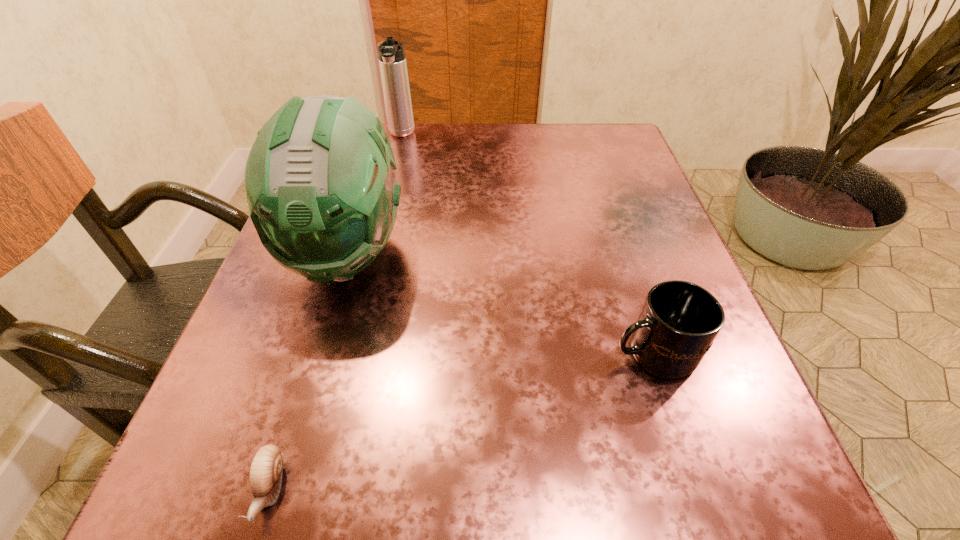
Where is `vacant area that lies between the farthest object and the shortest object`? The height and width of the screenshot is (540, 960). vacant area that lies between the farthest object and the shortest object is located at coordinates (336, 312).

Locate an element on the screen. The height and width of the screenshot is (540, 960). free area in between the nearest object and the second tallest object is located at coordinates (336, 312).

Identify the location of empty space between the rightmost object and the nearest object. The width and height of the screenshot is (960, 540). (462, 421).

Identify the location of free spot between the nearest object and the tallest object. The width and height of the screenshot is (960, 540). (309, 371).

Image resolution: width=960 pixels, height=540 pixels. Find the location of `empty location between the escargot and the third nearest object`. empty location between the escargot and the third nearest object is located at coordinates (309, 371).

Identify the location of empty space between the football helmet and the nearest object. (309, 371).

Identify which object is the second closest to the thermos bottle. Please provide its 2D coordinates. Your answer should be formatted as a tuple, i.e. [(x, y)], where the tuple contains the x and y coordinates of a point satisfying the conditions above.

[(679, 321)]

The height and width of the screenshot is (540, 960). In order to click on object that is the closest to the third nearest object in this screenshot , I will do `click(266, 468)`.

The height and width of the screenshot is (540, 960). I want to click on free location that satisfies the following two spatial constraints: 1. with the handle on the side of the mug; 2. on the front-facing side of the escargot, so click(696, 489).